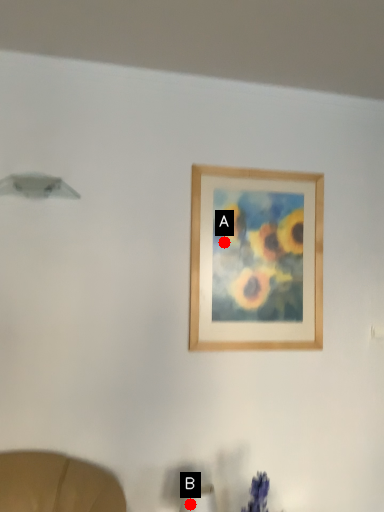
Question: Two points are circled on the image, labeled by A and B beside each circle. Which point is closer to the camera taking this photo?

Choices:
 (A) A is closer
 (B) B is closer

Answer: (B)